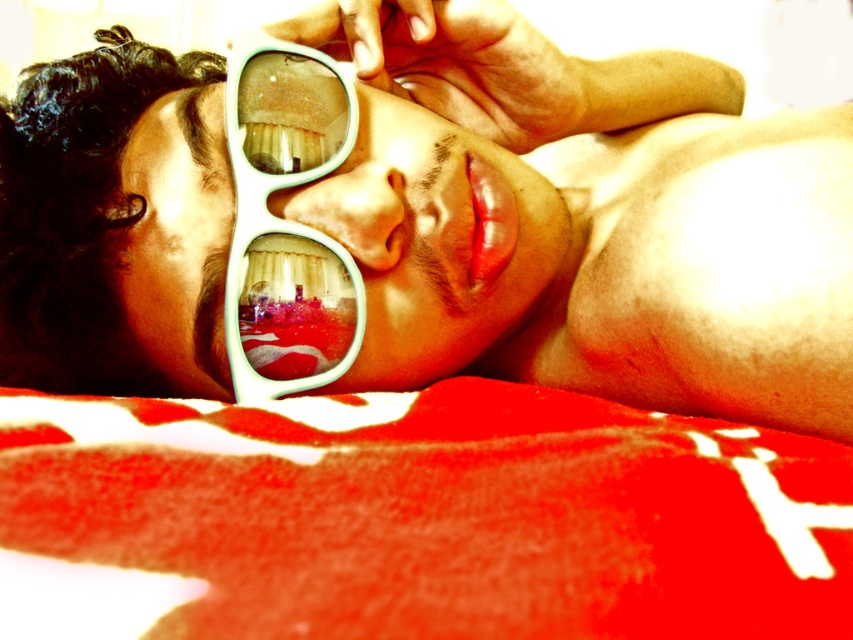
You are packing a beach bag for a sunny day. You have the red fuzzy blanket at lower center and the teal plastic goggles at center. Which item will take up more space in your bag?

The red fuzzy blanket at lower center will take up more space in your bag because its width is larger than that of the teal plastic goggles at center.

You are a fashion designer creating a new line of eyewear. You have two items in the image, the teal plastic sunglasses at center and the teal plastic goggles at center. Which one is taller?

The teal plastic sunglasses at center has a greater height compared to the teal plastic goggles at center, so the teal plastic sunglasses at center is taller.